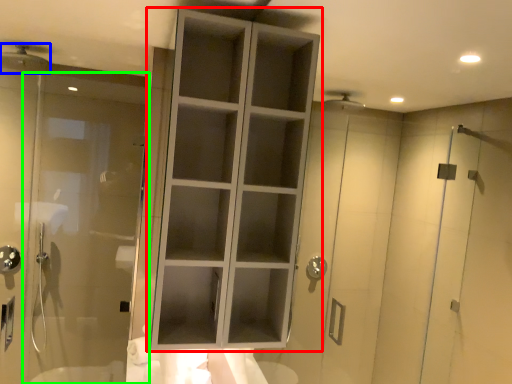
Question: Which object is the farthest from cupboard (highlighted by a red box)? Choose among these: shower (highlighted by a blue box) or door (highlighted by a green box).

Choices:
 (A) shower
 (B) door

Answer: (A)